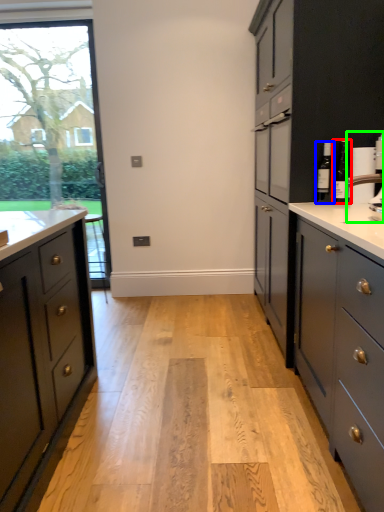
Question: Based on their relative distances, which object is nearer to bottle (highlighted by a red box)? Choose from bottle (highlighted by a blue box) and coffee machine (highlighted by a green box).

Choices:
 (A) bottle
 (B) coffee machine

Answer: (A)